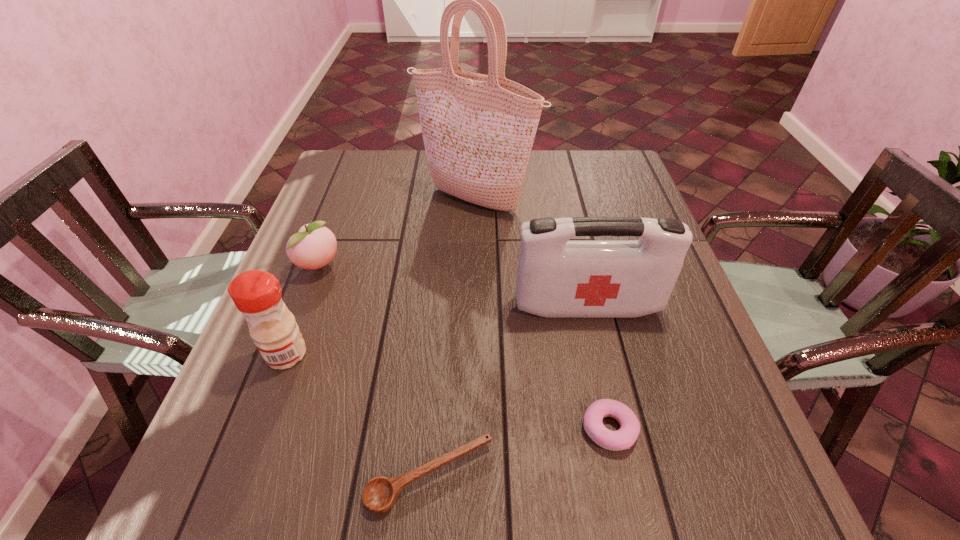
At what (x,y) coordinates should I click in order to perform the action: click on the farthest object. Please return your answer as a coordinate pair (x, y). The width and height of the screenshot is (960, 540). Looking at the image, I should click on (478, 130).

Where is `shopping bag`? The width and height of the screenshot is (960, 540). shopping bag is located at coordinates (478, 130).

At what (x,y) coordinates should I click in order to perform the action: click on the first-aid kit. Please return your answer as a coordinate pair (x, y). The image size is (960, 540). Looking at the image, I should click on (556, 278).

The width and height of the screenshot is (960, 540). I want to click on condiment, so click(257, 294).

Where is `the second farthest object`? the second farthest object is located at coordinates (314, 246).

Locate an element on the screen. the third shortest object is located at coordinates (314, 246).

You are a GUI agent. You are given a task and a screenshot of the screen. Output one action in this format:
    pyautogui.click(x=<x>, y=<y>)
    Task: Click on the pastry
    
    Given the screenshot: What is the action you would take?
    pyautogui.click(x=625, y=437)

In order to click on the shortest object in this screenshot , I will do `click(380, 494)`.

You are a GUI agent. You are given a task and a screenshot of the screen. Output one action in this format:
    pyautogui.click(x=<x>, y=<y>)
    Task: Click on the vacant region located on the back of the farthest object
    The width and height of the screenshot is (960, 540).
    Given the screenshot: What is the action you would take?
    pyautogui.click(x=476, y=167)

Identify the location of vacant space located 0.390m on the front side of the first-aid kit. The width and height of the screenshot is (960, 540). (636, 518).